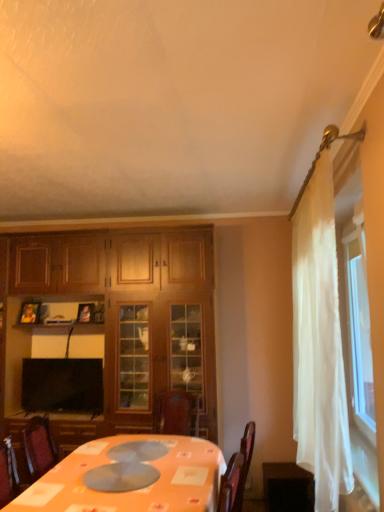
Question: From the image's perspective, does wooden picture frame at upper left, which is the second picture frame in right-to-left order, appear lower than matte black picture frame at upper left, the first picture frame in the right-to-left sequence?

Choices:
 (A) no
 (B) yes

Answer: (B)

Question: Can you confirm if wooden picture frame at upper left, which is the second picture frame in right-to-left order, is smaller than matte black picture frame at upper left, the first picture frame in the right-to-left sequence?

Choices:
 (A) yes
 (B) no

Answer: (B)

Question: Can you confirm if wooden picture frame at upper left, which ranks as the 1th picture frame in left-to-right order, is taller than matte black picture frame at upper left, the 2th picture frame viewed from the left?

Choices:
 (A) no
 (B) yes

Answer: (B)

Question: Could you tell me if wooden picture frame at upper left, which is the second picture frame in right-to-left order, is facing matte black picture frame at upper left, the 2th picture frame viewed from the left?

Choices:
 (A) yes
 (B) no

Answer: (B)

Question: Is wooden picture frame at upper left, which is the second picture frame in right-to-left order, positioned with its back to matte black picture frame at upper left, the 2th picture frame viewed from the left?

Choices:
 (A) no
 (B) yes

Answer: (A)

Question: From a real-world perspective, is wooden picture frame at upper left, which is the second picture frame in right-to-left order, beneath matte black picture frame at upper left, the 2th picture frame viewed from the left?

Choices:
 (A) no
 (B) yes

Answer: (A)

Question: Can you confirm if wooden cabinet at left is shorter than white sheer curtain at right?

Choices:
 (A) yes
 (B) no

Answer: (B)

Question: Is wooden cabinet at left located outside white sheer curtain at right?

Choices:
 (A) no
 (B) yes

Answer: (B)

Question: From the image's perspective, would you say wooden cabinet at left is positioned over white sheer curtain at right?

Choices:
 (A) no
 (B) yes

Answer: (A)

Question: Is white sheer curtain at right at the back of wooden cabinet at left?

Choices:
 (A) yes
 (B) no

Answer: (B)

Question: Considering the relative sizes of wooden cabinet at left and white sheer curtain at right in the image provided, is wooden cabinet at left bigger than white sheer curtain at right?

Choices:
 (A) no
 (B) yes

Answer: (B)

Question: Is wooden cabinet at left behind white sheer curtain at right?

Choices:
 (A) yes
 (B) no

Answer: (A)

Question: From a real-world perspective, is dark wood table at lower right located higher than black glossy tv at lower left?

Choices:
 (A) no
 (B) yes

Answer: (A)